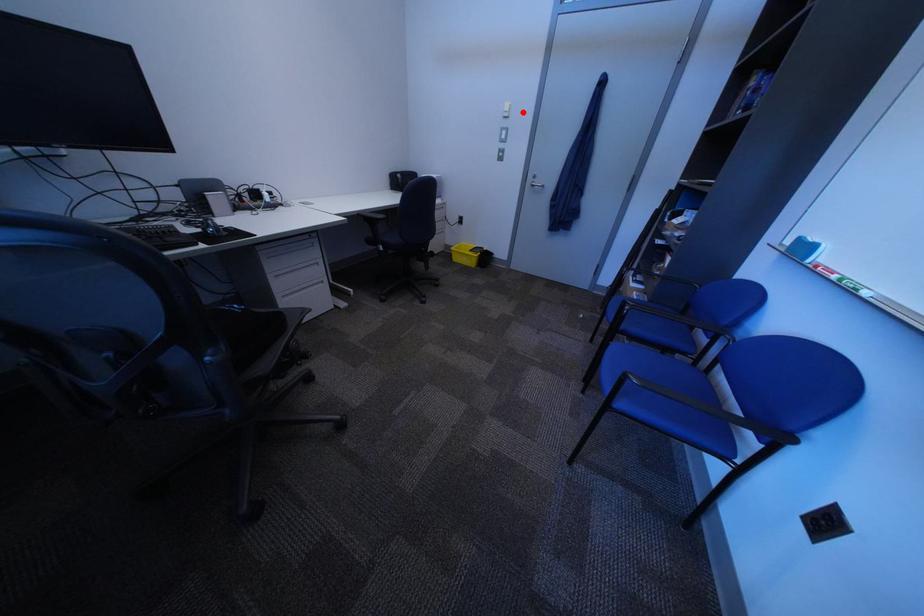
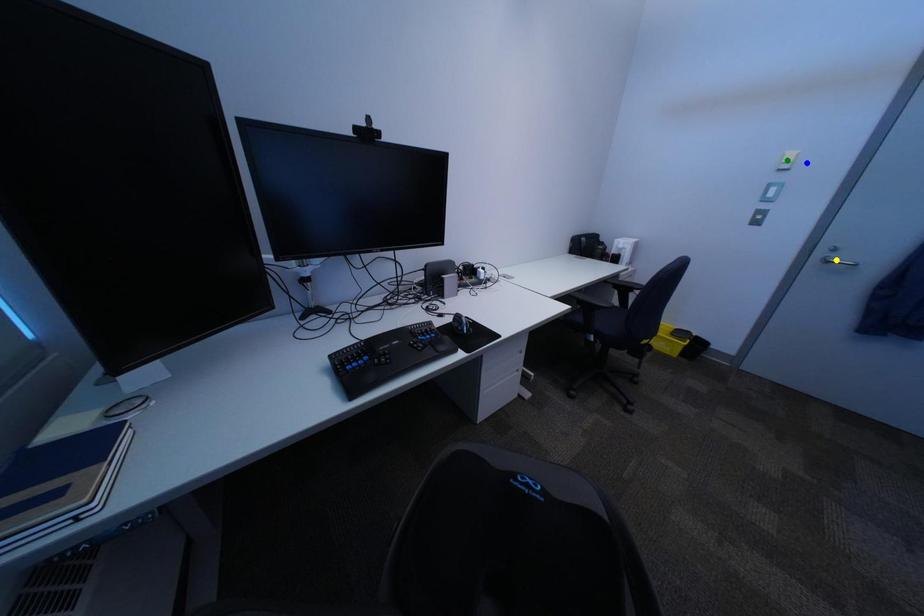
Question: I am providing you with two images of the same scene from different viewpoints. A red point is marked on the first image. You are given multiple points on the second image. Which mark in image 2 goes with the point in image 1?

Choices:
 (A) green point
 (B) blue point
 (C) yellow point

Answer: (B)